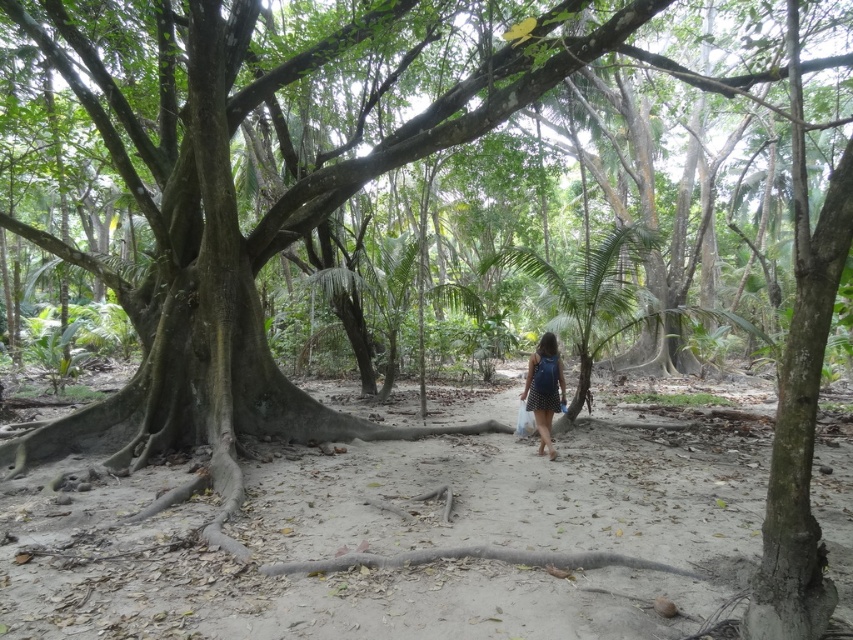
Is dirt path at center smaller than blue denim dress at center?

Yes, dirt path at center is smaller than blue denim dress at center.

Is point (546, 477) farther from camera compared to point (538, 339)?

That is False.

Is point (553, 634) farther from viewer compared to point (553, 458)?

No, (553, 634) is in front of (553, 458).

Where is `dirt path at center`? The image size is (853, 640). dirt path at center is located at coordinates (401, 541).